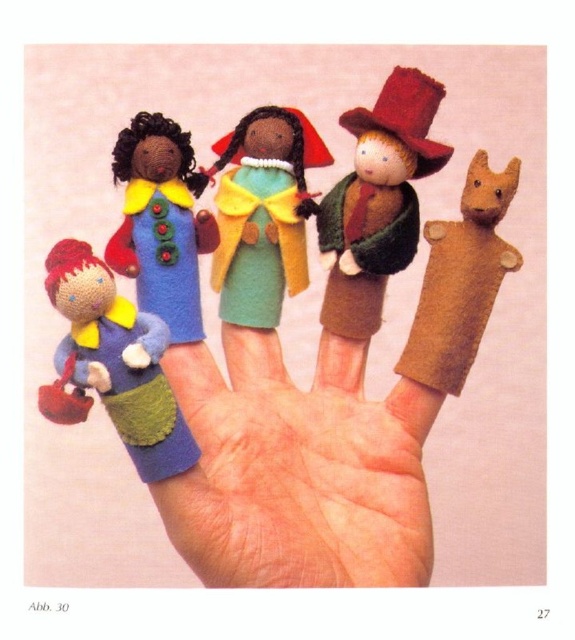
Question: Which point is farther to the camera?

Choices:
 (A) pyautogui.click(x=282, y=508)
 (B) pyautogui.click(x=373, y=280)
 (C) pyautogui.click(x=63, y=259)

Answer: (B)

Question: Does matte blue felt doll at left have a larger size compared to green felt doll at center?

Choices:
 (A) no
 (B) yes

Answer: (B)

Question: Is blue felt finger puppet at center to the left of green felt doll at center from the viewer's perspective?

Choices:
 (A) yes
 (B) no

Answer: (B)

Question: Which of the following is the closest to the observer?

Choices:
 (A) matte blue felt doll at left
 (B) blue felt doll at center
 (C) brown felt dog at right

Answer: (A)

Question: Where is velvet brown hat at upper right located in relation to brown felt dog at right in the image?

Choices:
 (A) left
 (B) right

Answer: (A)

Question: Which point appears closest to the camera in this image?

Choices:
 (A) (228, 186)
 (B) (194, 188)
 (C) (117, 364)

Answer: (C)